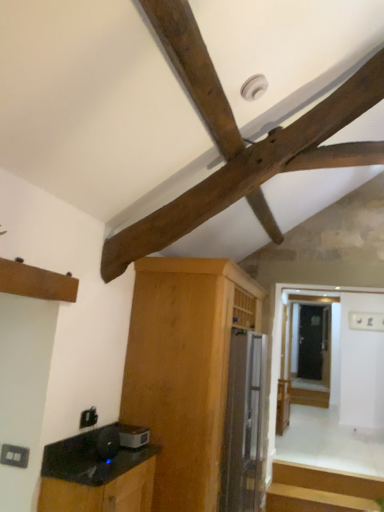
Question: Is light brown wood cabinet at center, marked as the first cabinetry in a back-to-front arrangement, wider or thinner than black glossy cabinet at lower left, which is counted as the second cabinetry, starting from the back?

Choices:
 (A) wide
 (B) thin

Answer: (A)

Question: From a real-world perspective, is light brown wood cabinet at center, acting as the 2th cabinetry starting from the front, above or below black glossy cabinet at lower left, which is the 1th cabinetry from front to back?

Choices:
 (A) below
 (B) above

Answer: (B)

Question: Estimate the real-world distances between objects in this image. Which object is closer to the light brown wood cabinet at center, acting as the 2th cabinetry starting from the front?

Choices:
 (A) satin silver toaster at lower center, which is the 1th appliance from top to bottom
 (B) satin silver refrigerator at center, the 2th appliance positioned from the front
 (C) black glossy cabinet at lower left, which is the 1th cabinetry from front to back
 (D) dark brown wood at upper center

Answer: (B)

Question: Which of these objects is positioned farthest from the light brown wood cabinet at center, acting as the 2th cabinetry starting from the front?

Choices:
 (A) satin silver toaster at lower center, which is the first appliance in front-to-back order
 (B) satin silver refrigerator at center, the 2th appliance when ordered from top to bottom
 (C) dark brown wood at upper center
 (D) black glossy cabinet at lower left, which is counted as the second cabinetry, starting from the back

Answer: (C)